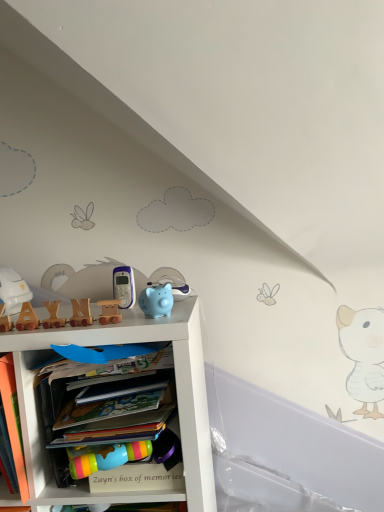
This screenshot has height=512, width=384. I want to click on vacant area located to the right-hand side of wooden train at center, arranged as the fourth toy when viewed from the right, so click(133, 313).